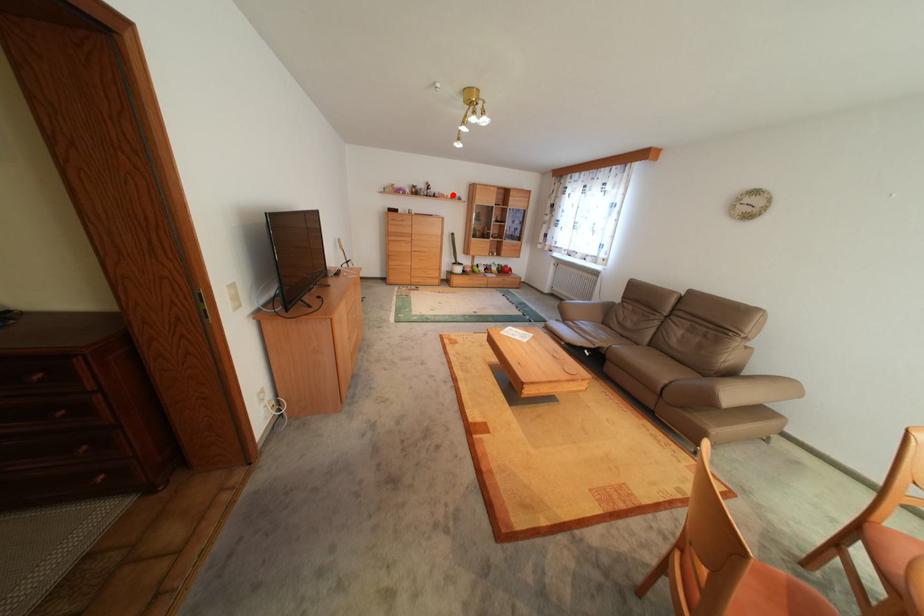
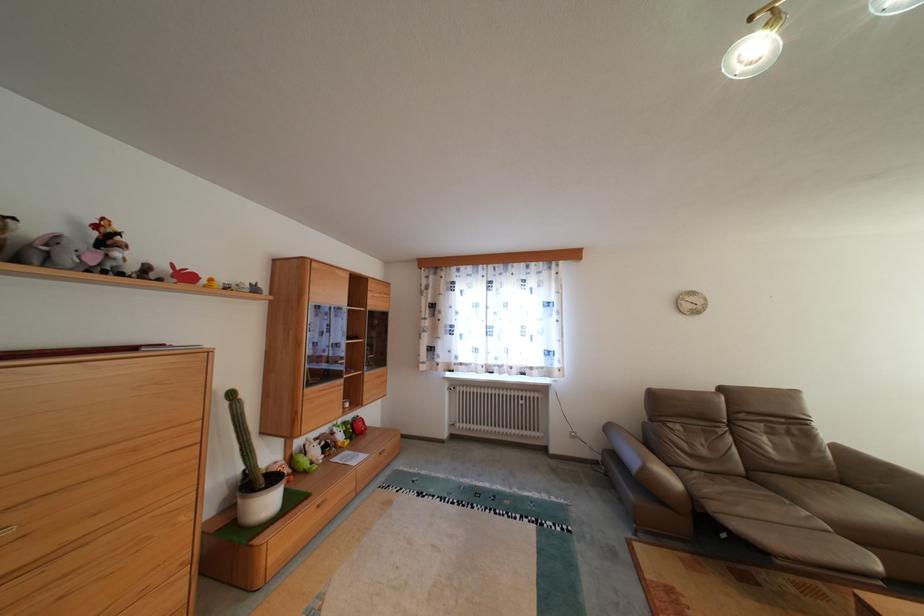
In the second image, find the point that corresponds to the highlighted location in the first image.

(198, 277)